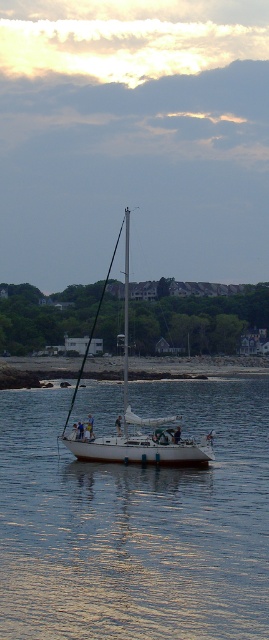
You are a sailor trying to secure the white glossy mast at center to the white matte sailboat at center with a rope. Which object should you attach the rope to first to ensure stability?

You should attach the rope to the white glossy mast at center first because it is the taller object and needs to be secured first for stability.

You are navigating a small drone that needs to land on the white smooth water at center. Based on the coordinates provided in the scene description, can you confirm if the landing zone is centrally located?

The white smooth water at center is located at coordinates point (136, 524), which indicates it is centrally positioned for the drone to land safely.

You are standing on the shore and want to walk to the white smooth water at center. Which direction should you move relative to the smooth sand at lower center?

You should move towards the white smooth water at center, which is smaller in size compared to the smooth sand at lower center, so it is located closer to the shore. Move towards the direction where the smooth sand at lower center is behind you.